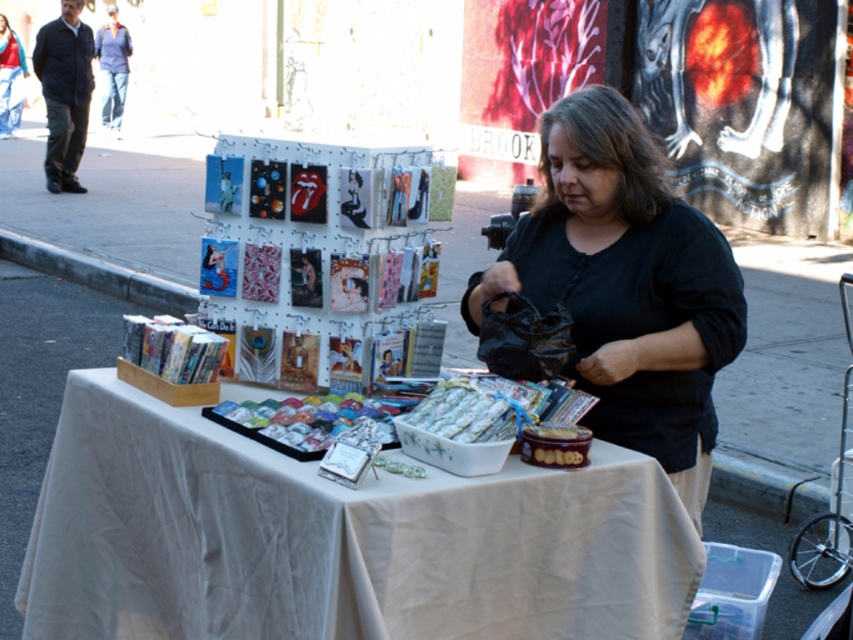
You are a customer at the outdoor market and want to buy a gift for your friend. You see the black leather jacket at upper left and the white glossy bowl at center. Which item is taller?

The black leather jacket at upper left is taller than the white glossy bowl at center.

You are a customer at the market and want to place a heavy item on the table. The table has a white cloth at center and a black leather jacket at upper left. Which item is more elevated and thus safer to place the item on?

The black leather jacket at upper left has a greater height compared to the white cloth at center, so placing the heavy item on the black leather jacket at upper left would be safer as it is higher up.

You are helping organize items at the market. You have a display shelf that can only hold items wider than 30 cm. Based on the scene, which object between the black leather jacket at upper left and the white glossy bowl at center should you place on the shelf?

The black leather jacket at upper left should be placed on the shelf because its width is larger than the white glossy bowl at center, and thus likely exceeds the 30 cm requirement.